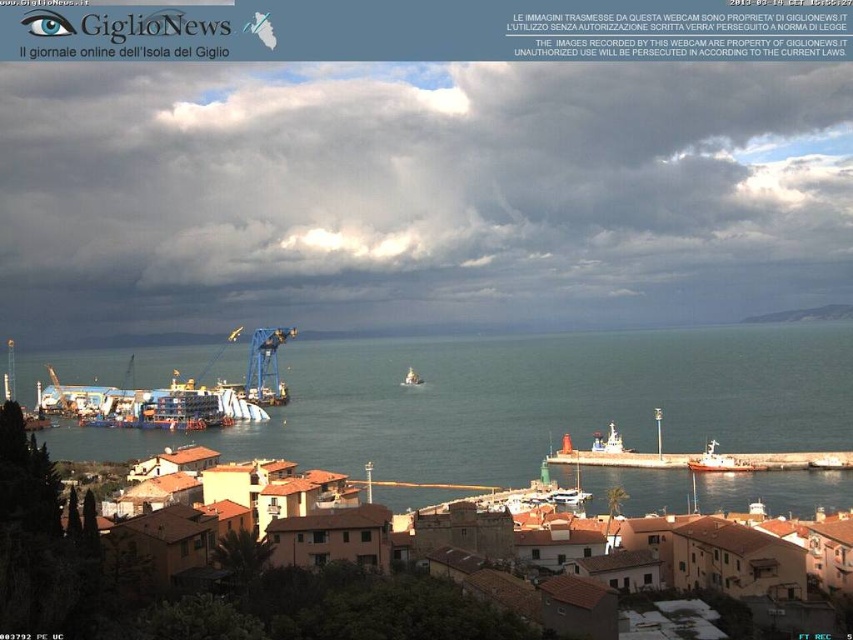
You are a sailor trying to dock your boat at the harbor. You see the metallic silver boat at lower right. Based on its position, can you estimate where it is located in the image?

The metallic silver boat at lower right is located at point 0.720 on the x axis and 0.838 on the y axis.

You are a sailor planning to dock your boat at the harbor. You see the blue water at center and the white plastic boat at center. Which one has a greater width?

The blue water at center has a greater width than the white plastic boat at center.

You are a sailor trying to navigate through the harbor. You see the metallic silver boat at lower right and the white plastic boat at center. Which boat is positioned lower in the image?

The metallic silver boat at lower right is positioned lower than the white plastic boat at center in the image.